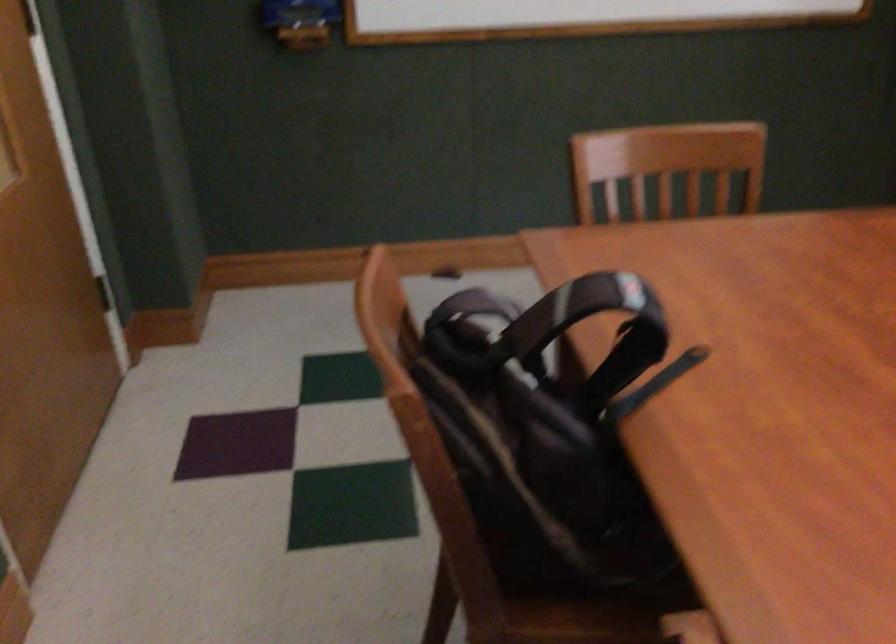
Image resolution: width=896 pixels, height=644 pixels. Describe the element at coordinates (625, 297) in the screenshot. I see `a black backpack handle` at that location.